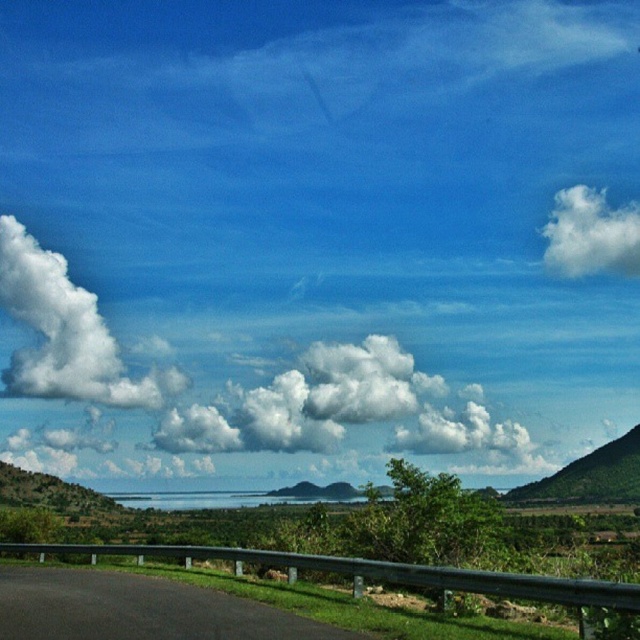
Question: From the image, what is the correct spatial relationship of black asphalt highway at lower left in relation to white fluffy cloud at upper left?

Choices:
 (A) left
 (B) right

Answer: (B)

Question: Among these points, which one is nearest to the camera?

Choices:
 (A) (612, 228)
 (B) (100, 376)
 (C) (628, 440)

Answer: (C)

Question: Is the position of white fluffy cloud at upper right less distant than that of green matte hill at right?

Choices:
 (A) yes
 (B) no

Answer: (B)

Question: Can you confirm if white fluffy cloud at upper center is thinner than white fluffy cloud at upper left?

Choices:
 (A) no
 (B) yes

Answer: (A)

Question: Which of the following is the farthest from the observer?

Choices:
 (A) (65, 385)
 (B) (579, 228)
 (C) (291, 621)
 (D) (161, 346)

Answer: (A)

Question: Which object appears farthest from the camera in this image?

Choices:
 (A) white fluffy cloud at upper left
 (B) white fluffy cloud at upper center

Answer: (A)